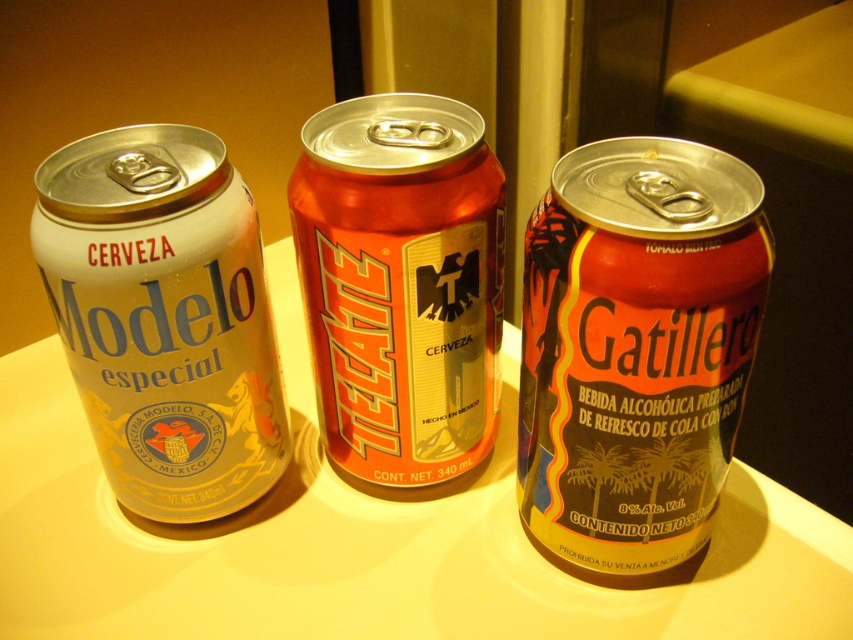
Which of these two, shiny metallic can at center or silver metallic can at left, stands shorter?

silver metallic can at left

Between shiny metallic can at center and silver metallic can at left, which one is positioned lower?

Positioned lower is shiny metallic can at center.

You are a GUI agent. You are given a task and a screenshot of the screen. Output one action in this format:
    pyautogui.click(x=<x>, y=<y>)
    Task: Click on the shiny metallic can at center
    The image size is (853, 640).
    Given the screenshot: What is the action you would take?
    pyautogui.click(x=636, y=349)

Which is below, silver metallic can at left or orange metallic can at center?

Positioned lower is silver metallic can at left.

Does point (231, 321) come closer to viewer compared to point (399, 160)?

No.

Find the location of a particular element. This screenshot has width=853, height=640. silver metallic can at left is located at coordinates (164, 316).

This screenshot has height=640, width=853. What do you see at coordinates (636, 349) in the screenshot? I see `shiny metallic can at center` at bounding box center [636, 349].

Image resolution: width=853 pixels, height=640 pixels. I want to click on shiny metallic can at center, so click(636, 349).